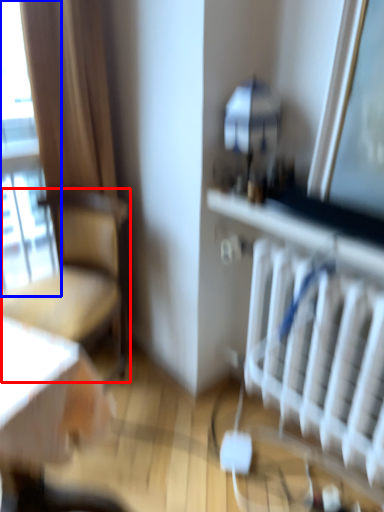
Question: Which point is closer to the camera, chair (highlighted by a red box) or window (highlighted by a blue box)?

Choices:
 (A) chair
 (B) window

Answer: (A)